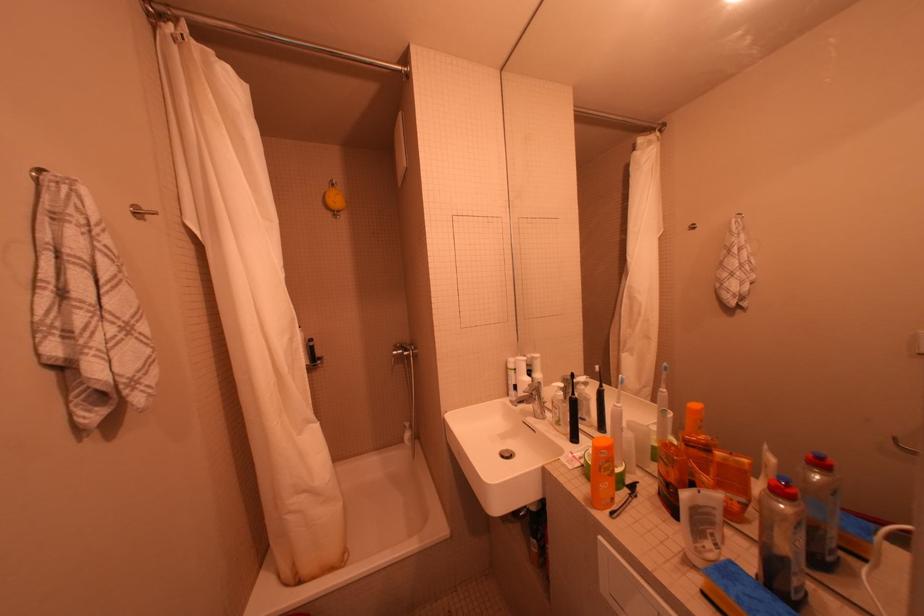
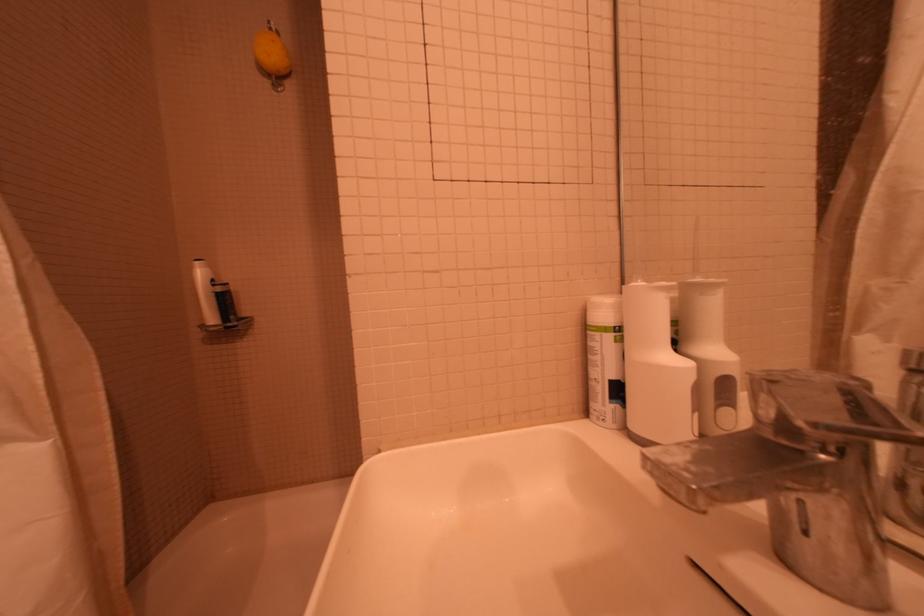
Question: In a continuous first-person perspective shot, in which direction is the camera moving?

Choices:
 (A) Left
 (B) Right
 (C) Forward
 (D) Backward

Answer: (C)